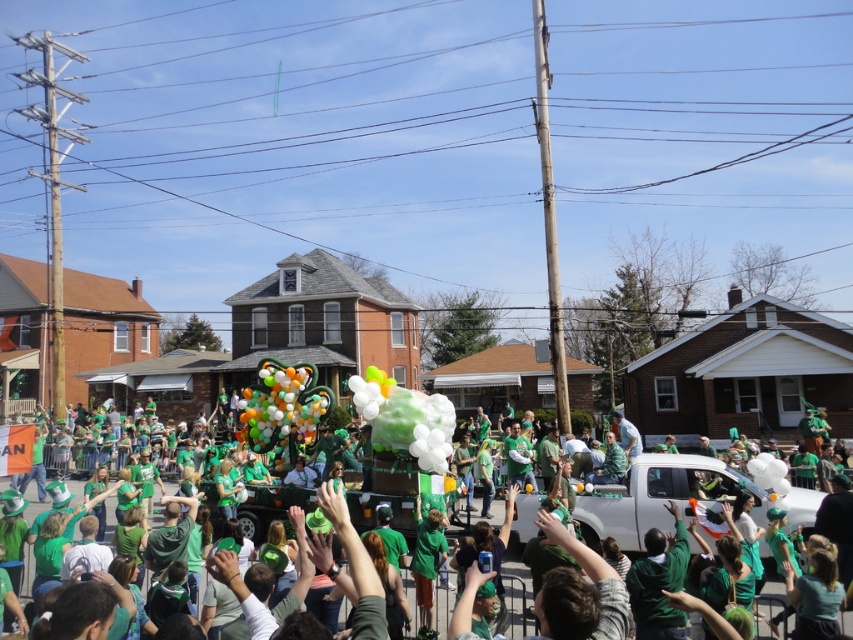
Can you confirm if translucent green cloud at center is positioned to the right of multicolored glossy balloons at center?

Correct, you'll find translucent green cloud at center to the right of multicolored glossy balloons at center.

Is translucent green cloud at center bigger than multicolored glossy balloons at center?

Yes, translucent green cloud at center is bigger than multicolored glossy balloons at center.

Does point (444, 472) come behind point (270, 372)?

No.

Where is `translucent green cloud at center`? This screenshot has height=640, width=853. translucent green cloud at center is located at coordinates (405, 419).

Is green fabric float at center shorter than translucent green cloud at center?

Indeed, green fabric float at center has a lesser height compared to translucent green cloud at center.

What do you see at coordinates (682, 477) in the screenshot?
I see `green fabric float at center` at bounding box center [682, 477].

Find the location of `green fabric float at center`. green fabric float at center is located at coordinates (682, 477).

Is point (526, 506) closer to viewer compared to point (283, 372)?

Yes, point (526, 506) is in front of point (283, 372).

Identify the location of green fabric float at center. Image resolution: width=853 pixels, height=640 pixels. (682, 477).